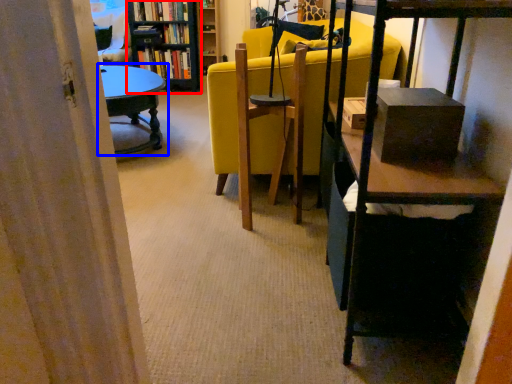
Question: Which point is closer to the camera, bookcase (highlighted by a red box) or table (highlighted by a blue box)?

Choices:
 (A) bookcase
 (B) table

Answer: (B)